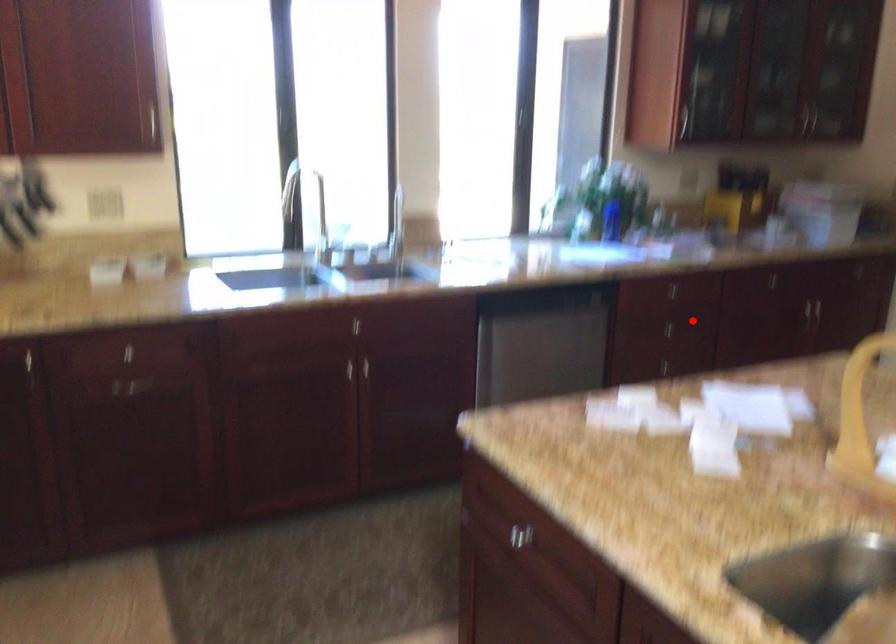
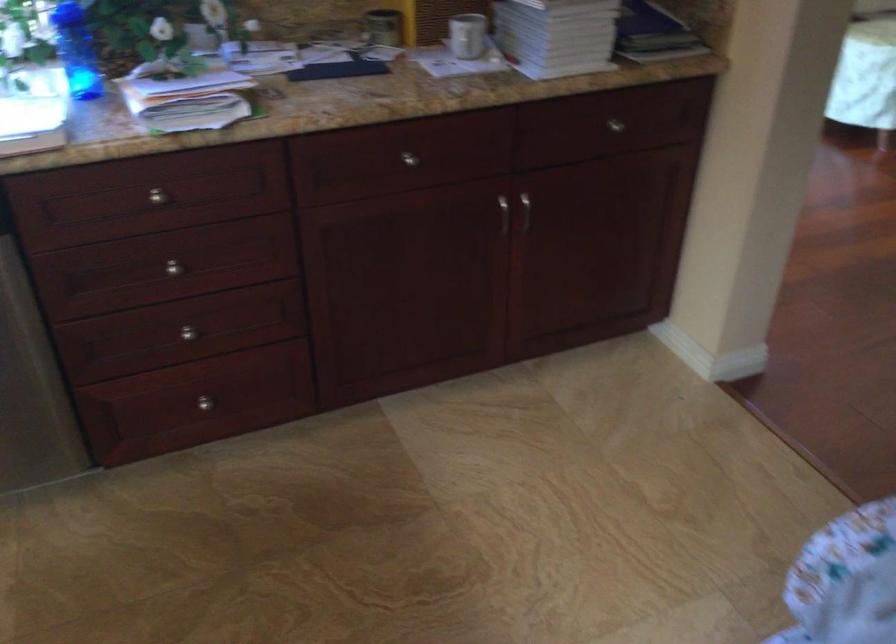
In the second image, find the point that corresponds to the highlighted location in the first image.

(174, 267)